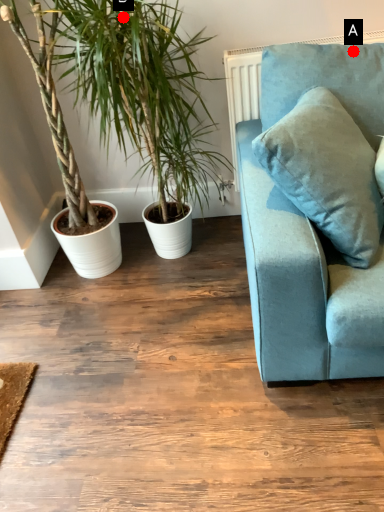
Question: Two points are circled on the image, labeled by A and B beside each circle. Which point is closer to the camera taking this photo?

Choices:
 (A) A is closer
 (B) B is closer

Answer: (B)